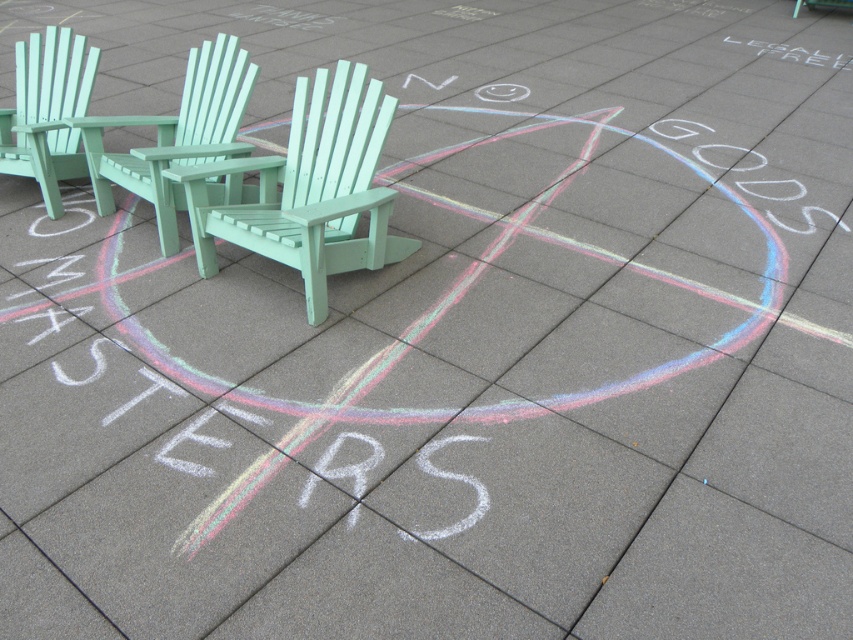
Can you confirm if mint green plastic beach chair at center is shorter than white chalk circle at lower left?

No, mint green plastic beach chair at center is not shorter than white chalk circle at lower left.

Is mint green plastic beach chair at center closer to the viewer compared to white chalk circle at lower left?

Yes, it is in front of white chalk circle at lower left.

Where is `mint green plastic beach chair at center`? The image size is (853, 640). mint green plastic beach chair at center is located at coordinates (177, 132).

Does mint green plastic beach chair at center appear on the right side of mint green plastic chair at left?

Yes, mint green plastic beach chair at center is to the right of mint green plastic chair at left.

Describe the element at coordinates (177, 132) in the screenshot. I see `mint green plastic beach chair at center` at that location.

The image size is (853, 640). Find the location of `mint green plastic beach chair at center`. mint green plastic beach chair at center is located at coordinates (177, 132).

Is mint green wood beach chair at center wider than white chalk smiley face at center?

Indeed, mint green wood beach chair at center has a greater width compared to white chalk smiley face at center.

Which is in front, point (276, 248) or point (515, 88)?

Positioned in front is point (276, 248).

Between point (401, 250) and point (486, 84), which one is positioned behind?

The point (486, 84) is more distant.

Where is `mint green wood beach chair at center`? This screenshot has height=640, width=853. mint green wood beach chair at center is located at coordinates (311, 188).